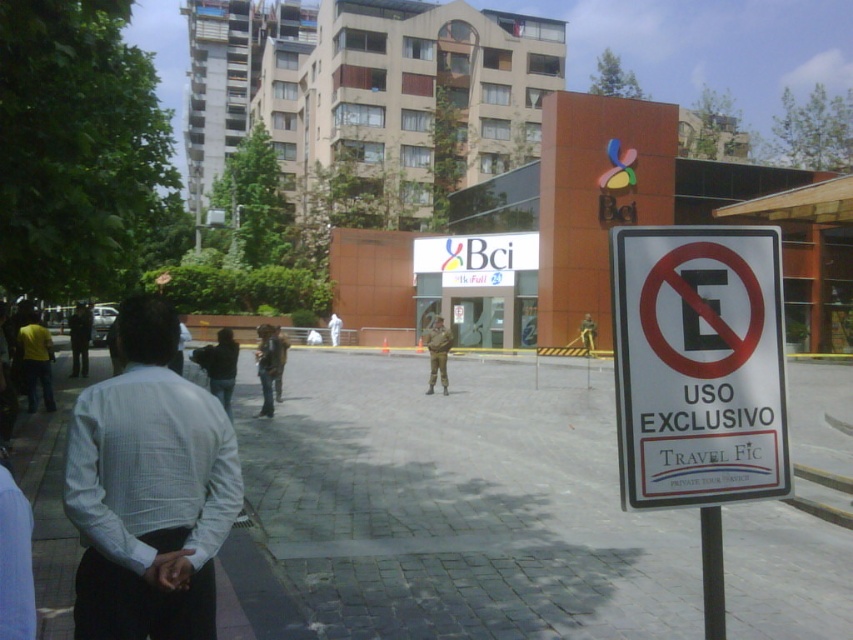
Question: Which point is farther from the camera taking this photo?

Choices:
 (A) (677, 227)
 (B) (436, 356)
 (C) (78, 321)
 (D) (177, 372)

Answer: (C)

Question: Which of the following is the closest to the observer?

Choices:
 (A) white plastic sign at lower right
 (B) black metal pole at right

Answer: (A)

Question: Can you confirm if camouflage uniform at center is positioned to the right of dark blue uniform at center?

Choices:
 (A) yes
 (B) no

Answer: (A)

Question: Does black metal pole at right appear under camouflage uniform at center?

Choices:
 (A) yes
 (B) no

Answer: (A)

Question: Does white checkered shirt at left have a greater width compared to camouflage uniform at center?

Choices:
 (A) no
 (B) yes

Answer: (A)

Question: Which point is closer to the camera?

Choices:
 (A) (189, 448)
 (B) (77, 353)
 (C) (444, 394)

Answer: (A)